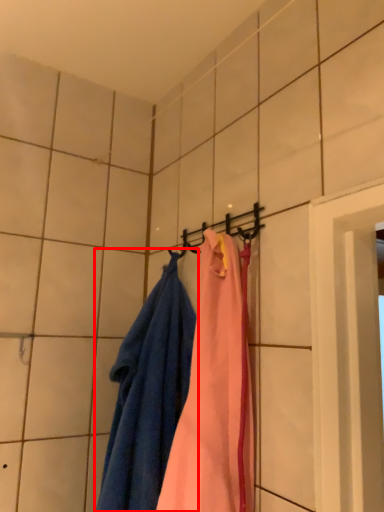
Question: From the image's perspective, what is the correct spatial positioning of towel (annotated by the red box) in reference to hanger?

Choices:
 (A) above
 (B) below

Answer: (B)